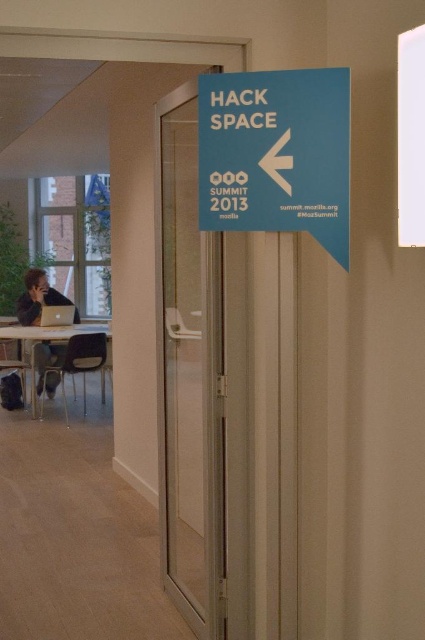
Question: Estimate the real-world distances between objects in this image. Which object is farther from the silver metallic laptop at left?

Choices:
 (A) wooden table at lower left
 (B) blue matte sign at center

Answer: (B)

Question: Is dark blue shirt at lower left behind silver metallic laptop at left?

Choices:
 (A) no
 (B) yes

Answer: (B)

Question: Which point is farther to the camera?

Choices:
 (A) blue matte sign at center
 (B) silver metallic laptop at left

Answer: (B)

Question: Where is blue matte sign at center located in relation to wooden table at lower left in the image?

Choices:
 (A) left
 (B) right

Answer: (B)

Question: Which is nearer to the wooden table at lower left?

Choices:
 (A) transparent glass door at center
 (B) silver metallic laptop at left

Answer: (B)

Question: Does transparent glass door at center have a larger size compared to silver metallic laptop at left?

Choices:
 (A) no
 (B) yes

Answer: (B)